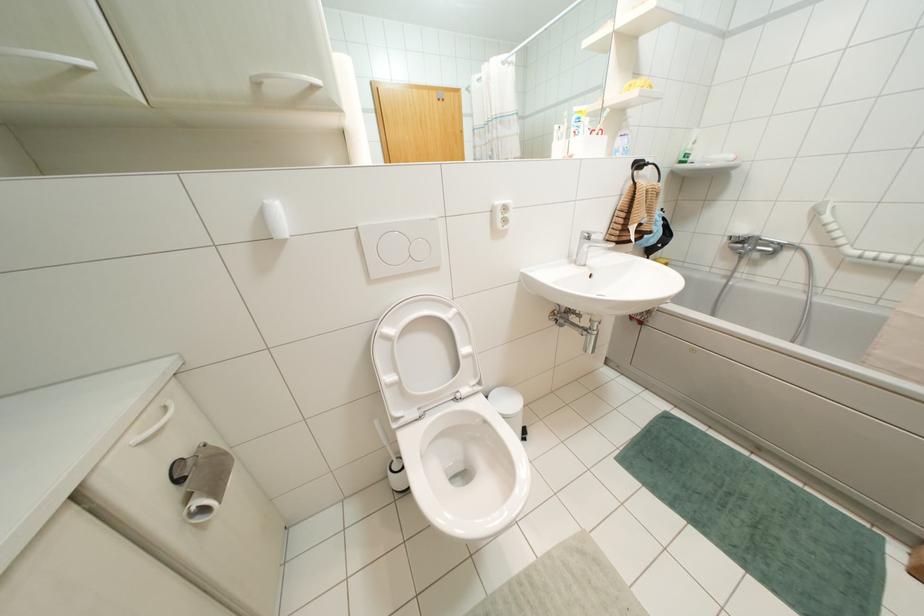
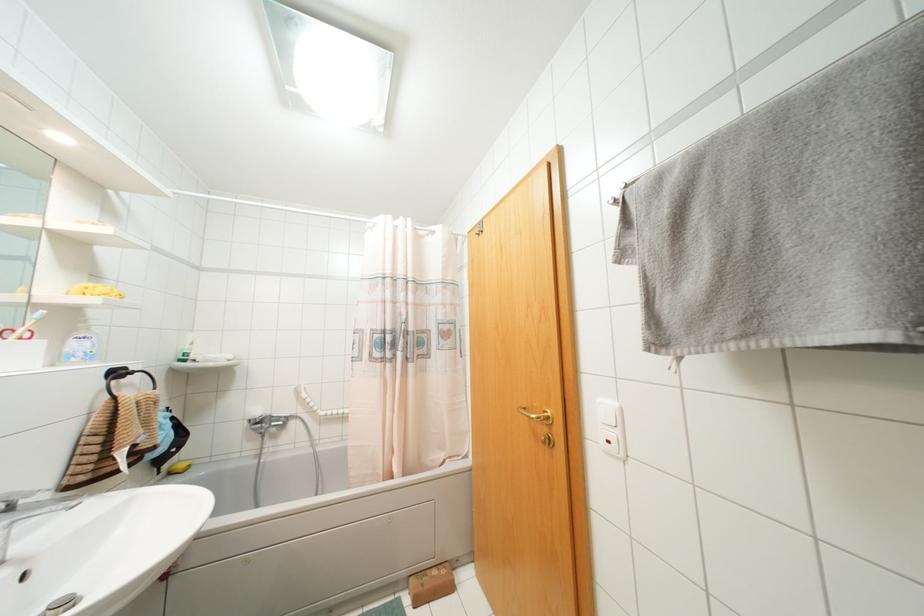
The point at (694, 142) is marked in the first image. Where is the corresponding point in the second image?

(190, 342)